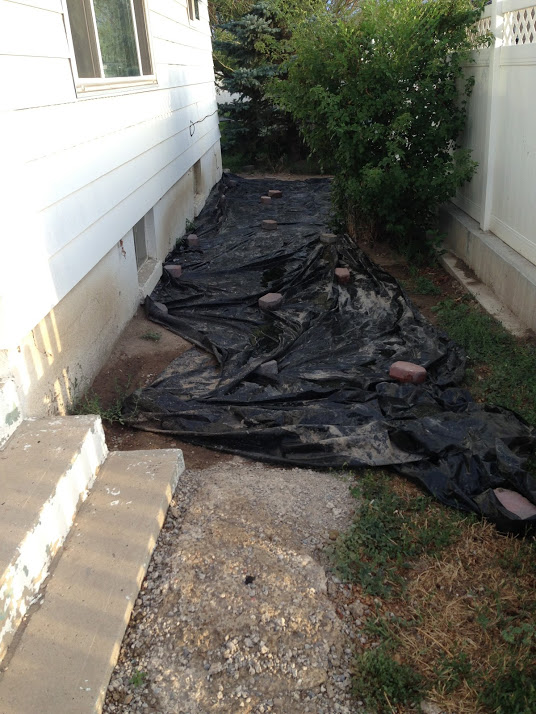
Where is `wall`? The width and height of the screenshot is (536, 714). wall is located at coordinates (509, 176).